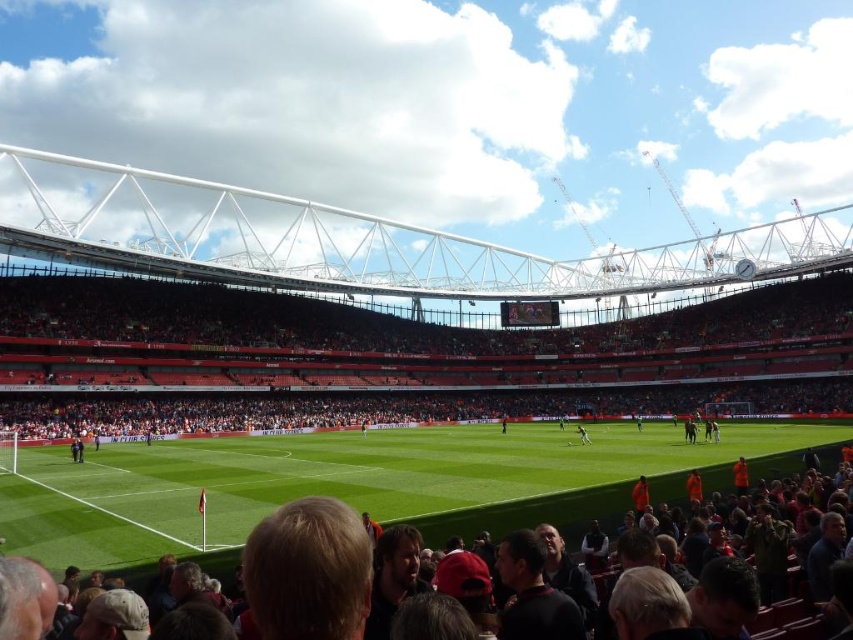
You are a stadium manager planning to replace the green grass at center with new artificial turf. The artificial turf rolls are 2 meters wide. Considering the existing red plastic seats at center, will the artificial turf fit between the seats?

The red plastic seats at center are wider than the green grass at center. Since the artificial turf rolls are 2 meters wide, you need to measure the width of the green grass area to ensure the turf will fit. However, since the seats are wider, the grass area might be narrower than 2 meters, so it may not fit without adjustments.

You are a drone operator flying a drone over the football stadium. Your drone is currently hovering above the green grass football field at center. You need to land your drone at the point with coordinates point (363, 481). Will the drone land on the green grass football field at center?

Yes, the point (363, 481) is on the green grass football field at center, so the drone will land there.